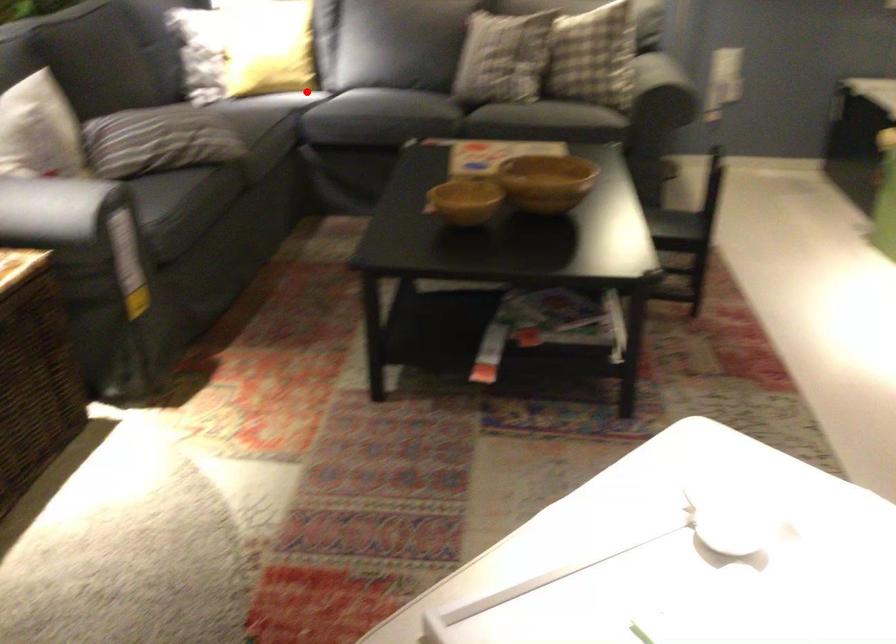
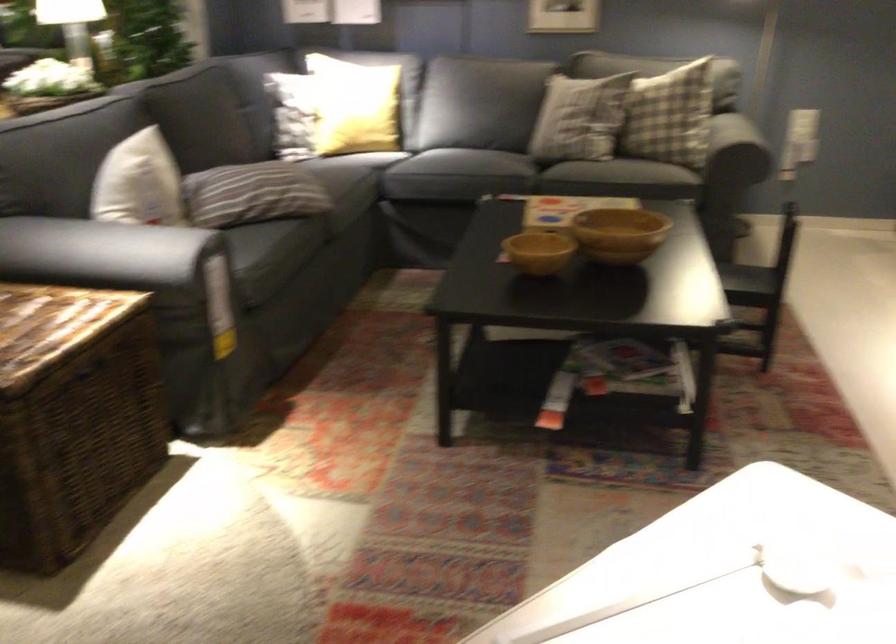
The point at the highlighted location is marked in the first image. Where is the corresponding point in the second image?

(386, 149)